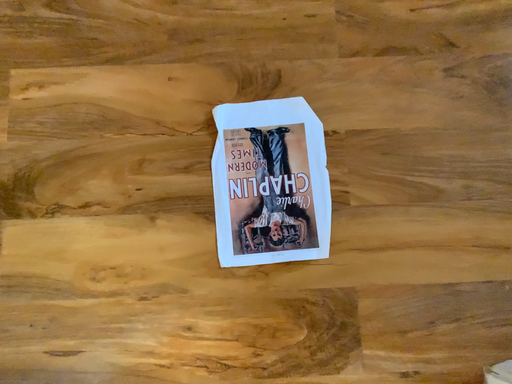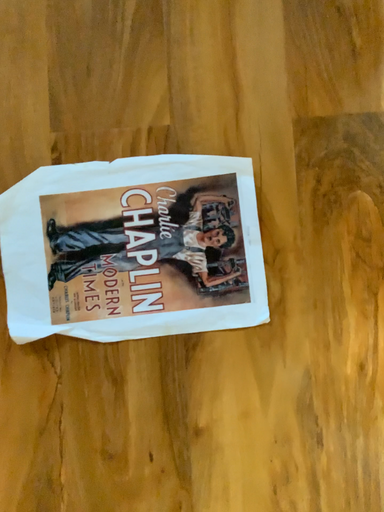
Question: Which way did the camera rotate in the video?

Choices:
 (A) rotated left
 (B) rotated right

Answer: (B)